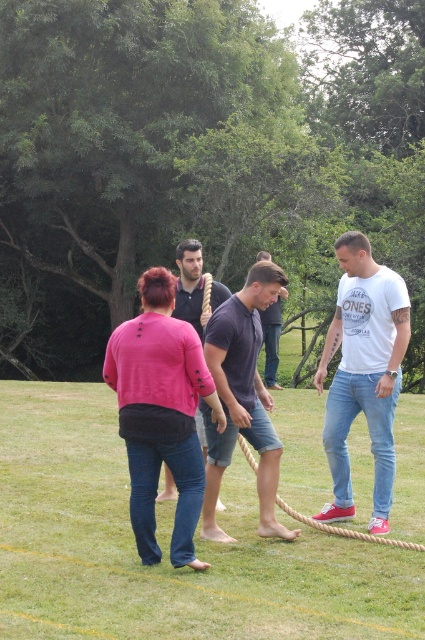
You are a photographer trying to capture a photo of the denim jeans at center and smooth blue jeans at center. Which one is positioned lower in the image?

Result: The denim jeans at center is located below smooth blue jeans at center, so the denim jeans at center is positioned lower in the image.